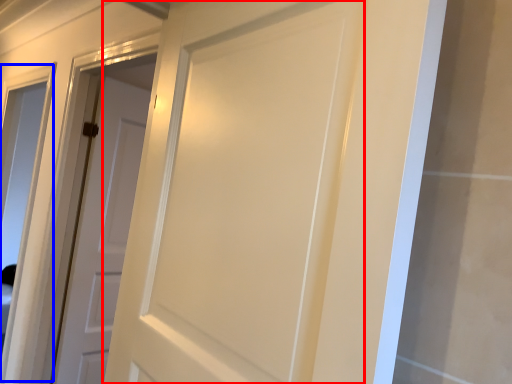
Question: Which point is closer to the camera, door (highlighted by a red box) or window (highlighted by a blue box)?

Choices:
 (A) door
 (B) window

Answer: (A)